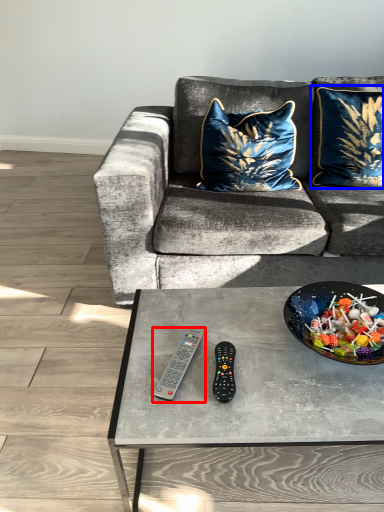
Question: Which point is further to the camera, remote control (highlighted by a red box) or pillow (highlighted by a blue box)?

Choices:
 (A) remote control
 (B) pillow

Answer: (B)